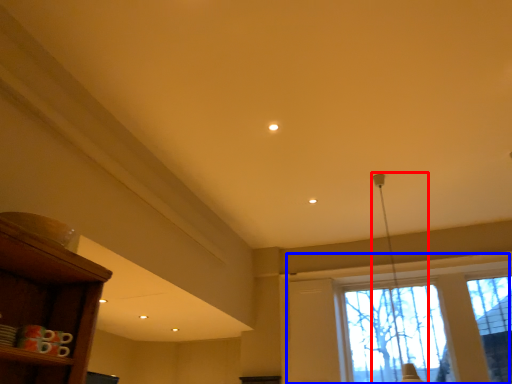
Question: Which of the following is the closest to the observer, lamp (highlighted by a red box) or window (highlighted by a blue box)?

Choices:
 (A) lamp
 (B) window

Answer: (A)